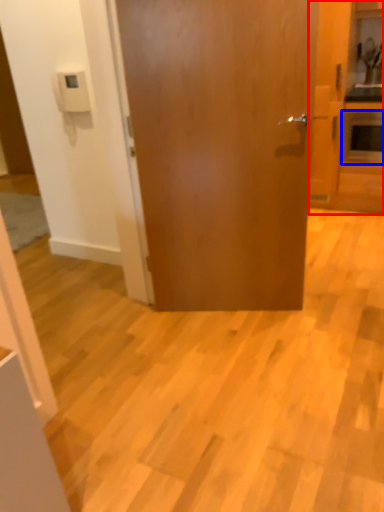
Question: Among these objects, which one is farthest to the camera, cabinetry (highlighted by a red box) or appliance (highlighted by a blue box)?

Choices:
 (A) cabinetry
 (B) appliance

Answer: (B)